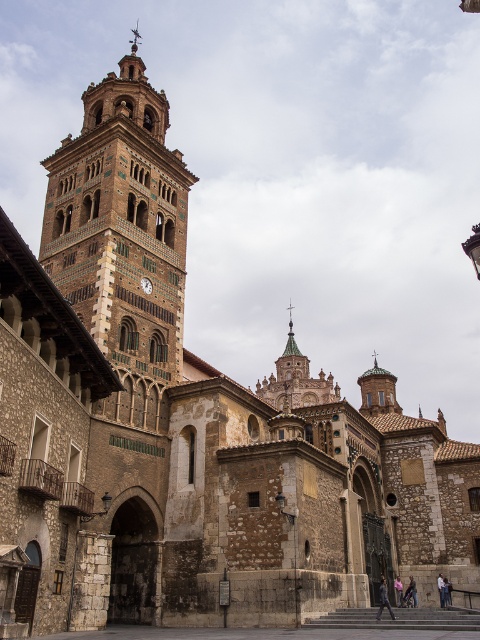
Is terracotta brick tower at left smaller than golden ornate spire at center?

Correct, terracotta brick tower at left occupies less space than golden ornate spire at center.

Is point (132, 321) farther from viewer compared to point (285, 396)?

That is False.

Locate an element on the screen. This screenshot has width=480, height=640. terracotta brick tower at left is located at coordinates (122, 236).

Which is below, terracotta brick tower at left or matte brown clock at upper left?

matte brown clock at upper left

Can you confirm if terracotta brick tower at left is bigger than matte brown clock at upper left?

Yes, terracotta brick tower at left is bigger than matte brown clock at upper left.

This screenshot has height=640, width=480. Find the location of `terracotta brick tower at left`. terracotta brick tower at left is located at coordinates (122, 236).

Who is more forward, (313, 381) or (143, 282)?

Positioned in front is point (143, 282).

Does golden ornate spire at center appear under matte brown clock at upper left?

Correct, golden ornate spire at center is located below matte brown clock at upper left.

Is point (302, 388) closer to viewer compared to point (152, 288)?

No, (302, 388) is behind (152, 288).

The height and width of the screenshot is (640, 480). Identify the location of golden ornate spire at center. (296, 380).